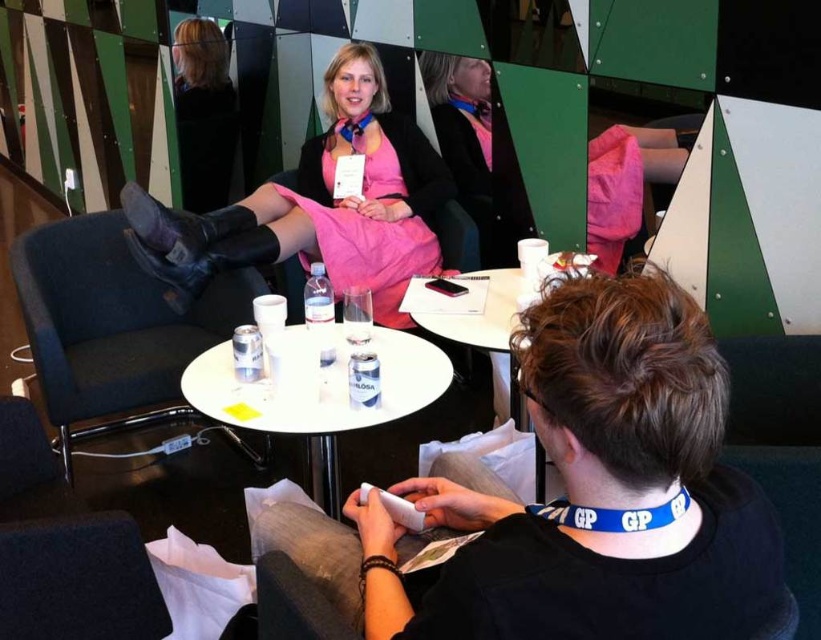
Question: Does pink matte dress at center have a larger size compared to white plastic table at center?

Choices:
 (A) no
 (B) yes

Answer: (B)

Question: Which point is closer to the camera?

Choices:
 (A) (553, 317)
 (B) (365, 180)
 (C) (336, 326)

Answer: (A)

Question: Which of the following is the farthest from the observer?

Choices:
 (A) white plastic table at center
 (B) black matte phone at lower center
 (C) pink matte dress at center

Answer: (C)

Question: Estimate the real-world distances between objects in this image. Which object is farther from the pink matte dress at center?

Choices:
 (A) white plastic table at center
 (B) black matte phone at lower center

Answer: (B)

Question: Does black matte phone at lower center come behind white plastic table at center?

Choices:
 (A) yes
 (B) no

Answer: (B)

Question: Does pink matte dress at center have a larger size compared to white plastic table at center?

Choices:
 (A) no
 (B) yes

Answer: (B)